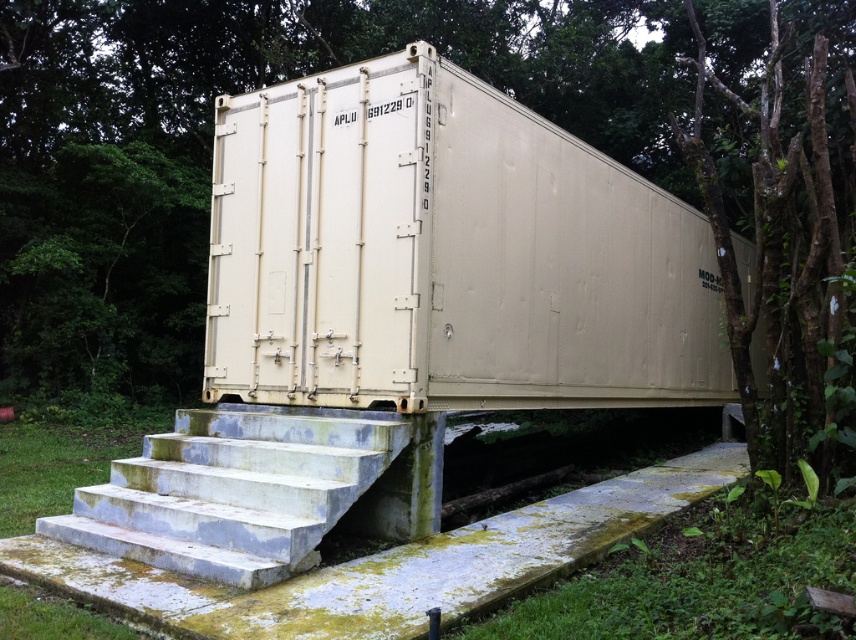
Who is higher up, beige matte container at center or green leafy tree at upper right?

green leafy tree at upper right is above.

Is point (551, 147) closer to camera compared to point (745, 333)?

No, it is behind (745, 333).

Where is `beige matte container at center`? This screenshot has width=856, height=640. beige matte container at center is located at coordinates (446, 253).

Where is `beige matte container at center`? This screenshot has height=640, width=856. beige matte container at center is located at coordinates (446, 253).

Between beige matte container at center and smooth concrete stairs at lower center, which one has less height?

beige matte container at center is shorter.

Is beige matte container at center above smooth concrete stairs at lower center?

Correct, beige matte container at center is located above smooth concrete stairs at lower center.

Between point (342, 372) and point (230, 580), which one is positioned in front?

Positioned in front is point (230, 580).

At what (x,y) coordinates should I click in order to perform the action: click on beige matte container at center. Please return your answer as a coordinate pair (x, y). The image size is (856, 640). Looking at the image, I should click on (446, 253).

Between smooth concrete stairs at lower center and green leafy tree at upper right, which one is positioned lower?

smooth concrete stairs at lower center is lower down.

Does smooth concrete stairs at lower center have a lesser height compared to green leafy tree at upper right?

Indeed, smooth concrete stairs at lower center has a lesser height compared to green leafy tree at upper right.

Who is more forward, [242,525] or [752,106]?

Positioned in front is point [242,525].

Locate an element on the screen. smooth concrete stairs at lower center is located at coordinates (235, 490).